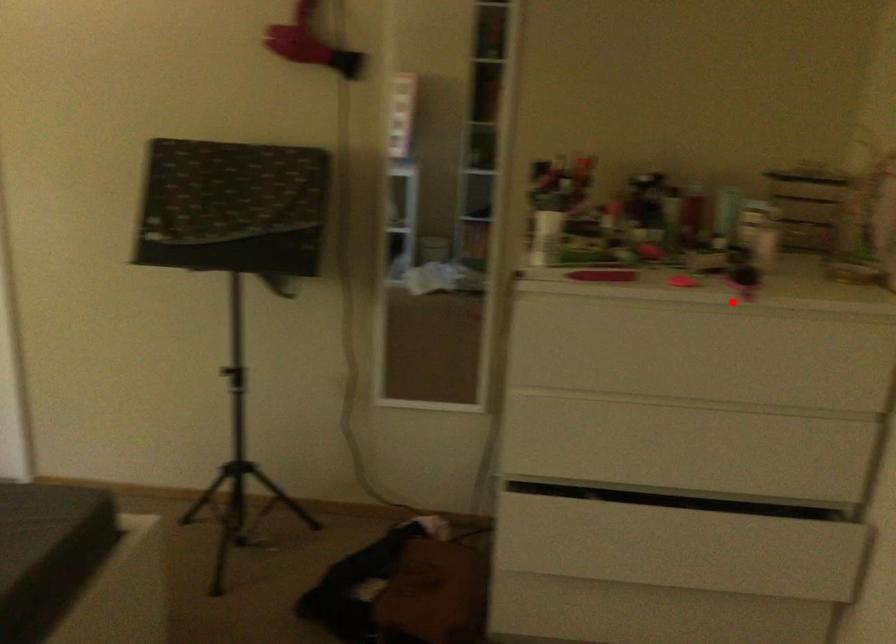
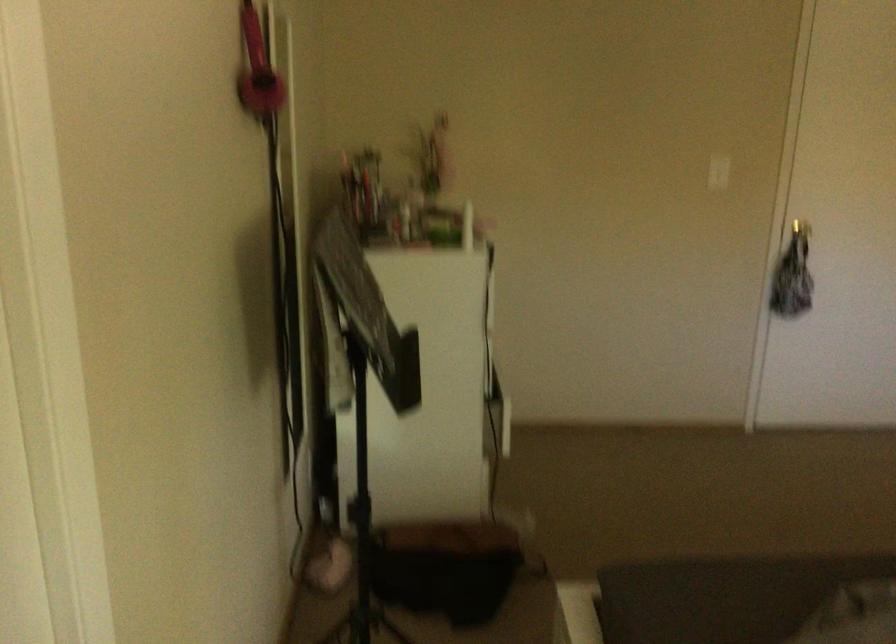
Question: I am providing you with two images of the same scene from different viewpoints. A red point is marked on the first image. At the location where the point appears in image 1, is it still visible in image 2?

Choices:
 (A) Yes
 (B) No

Answer: (B)